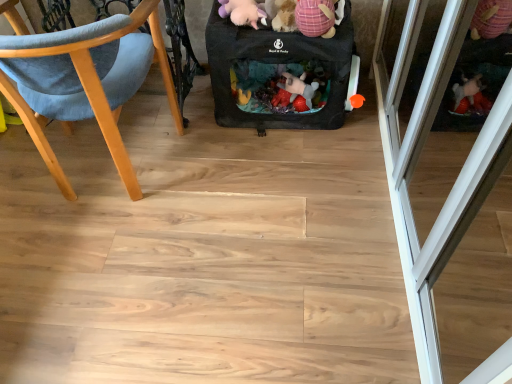
Question: In which direction should I rotate to look at purple plush toy at upper center, which is counted as the 2th toy, starting from the right?

Choices:
 (A) right
 (B) left

Answer: (B)

Question: Is wooden chair at left behind transparent glass screen door at right?

Choices:
 (A) no
 (B) yes

Answer: (B)

Question: From the image's perspective, does wooden chair at left appear higher than transparent glass screen door at right?

Choices:
 (A) no
 (B) yes

Answer: (B)

Question: From the image's perspective, is wooden chair at left located beneath transparent glass screen door at right?

Choices:
 (A) no
 (B) yes

Answer: (A)

Question: Considering the relative positions of wooden chair at left and transparent glass screen door at right in the image provided, is wooden chair at left to the right of transparent glass screen door at right from the viewer's perspective?

Choices:
 (A) yes
 (B) no

Answer: (B)

Question: Would you say wooden chair at left contains transparent glass screen door at right?

Choices:
 (A) no
 (B) yes

Answer: (A)

Question: Is wooden chair at left positioned beyond the bounds of transparent glass screen door at right?

Choices:
 (A) yes
 (B) no

Answer: (A)

Question: Can you confirm if pink plaid fabric stuffed animal at upper center, positioned as the first toy in right-to-left order, is wider than transparent glass screen door at right?

Choices:
 (A) no
 (B) yes

Answer: (A)

Question: Can you confirm if pink plaid fabric stuffed animal at upper center, the second toy viewed from the left, is positioned to the right of transparent glass screen door at right?

Choices:
 (A) no
 (B) yes

Answer: (A)

Question: From the image's perspective, is pink plaid fabric stuffed animal at upper center, positioned as the first toy in right-to-left order, under transparent glass screen door at right?

Choices:
 (A) no
 (B) yes

Answer: (A)

Question: Is pink plaid fabric stuffed animal at upper center, positioned as the first toy in right-to-left order, facing towards transparent glass screen door at right?

Choices:
 (A) no
 (B) yes

Answer: (A)

Question: Is pink plaid fabric stuffed animal at upper center, the second toy viewed from the left, not near transparent glass screen door at right?

Choices:
 (A) no
 (B) yes

Answer: (A)

Question: Does pink plaid fabric stuffed animal at upper center, positioned as the first toy in right-to-left order, have a lesser height compared to transparent glass screen door at right?

Choices:
 (A) no
 (B) yes

Answer: (B)

Question: Considering the relative sizes of black fabric baby carriage at center and pink plaid fabric stuffed animal at upper center, the second toy viewed from the left, in the image provided, is black fabric baby carriage at center shorter than pink plaid fabric stuffed animal at upper center, the second toy viewed from the left,?

Choices:
 (A) no
 (B) yes

Answer: (A)